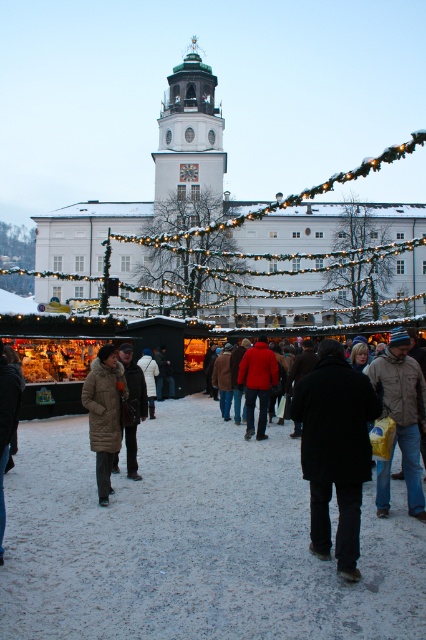
Describe the element at coordinates (334, 451) in the screenshot. This screenshot has width=426, height=640. I see `black matte coat at center` at that location.

Is black matte coat at center smaller than brown wool coat at center?

No, black matte coat at center is not smaller than brown wool coat at center.

Is point (305, 380) positioned after point (137, 406)?

No, it is in front of (137, 406).

Where is `black matte coat at center`? Image resolution: width=426 pixels, height=640 pixels. black matte coat at center is located at coordinates (334, 451).

Does point (158, 147) come behind point (150, 362)?

Yes, it is.

Can you confirm if white stone bell tower at center is bigger than white fur coat at center?

Yes.

The width and height of the screenshot is (426, 640). I want to click on white stone bell tower at center, so click(189, 145).

The height and width of the screenshot is (640, 426). Find the location of `white stone bell tower at center`. white stone bell tower at center is located at coordinates (189, 145).

What do you see at coordinates (103, 413) in the screenshot?
I see `brown fur coat at lower left` at bounding box center [103, 413].

Which is more to the left, brown fur coat at lower left or brown wool coat at center?

From the viewer's perspective, brown fur coat at lower left appears more on the left side.

Who is more forward, (x=109, y=344) or (x=131, y=476)?

Point (x=131, y=476)

Image resolution: width=426 pixels, height=640 pixels. What are the coordinates of `brown fur coat at lower left` in the screenshot? It's located at (103, 413).